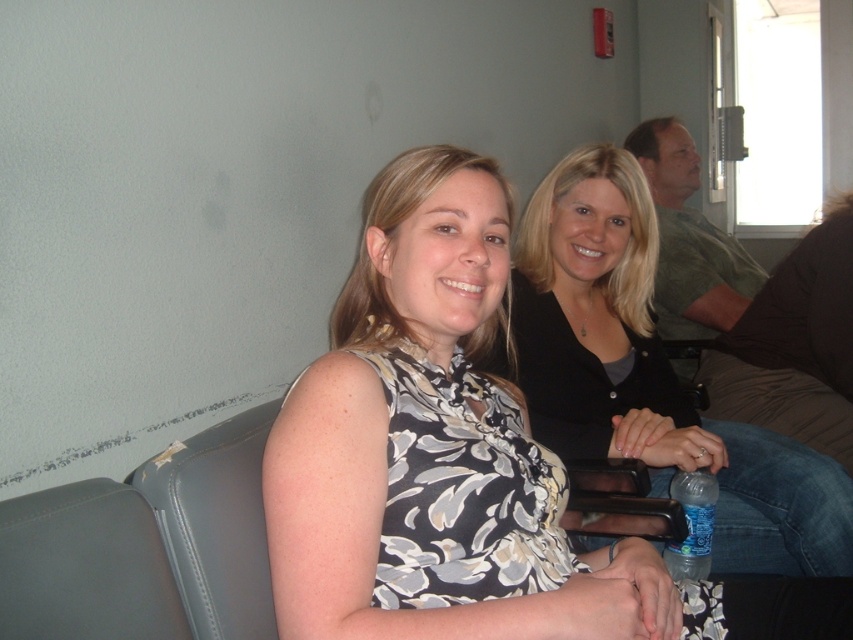
From the picture: Who is shorter, floral print blouse at center or blue plastic bottle at lower right?

blue plastic bottle at lower right

How far apart are floral print blouse at center and blue plastic bottle at lower right?

floral print blouse at center and blue plastic bottle at lower right are 23.69 inches apart from each other.

Does point (407, 396) come farther from viewer compared to point (682, 493)?

No, it is in front of (682, 493).

Locate an element on the screen. floral print blouse at center is located at coordinates (450, 456).

Does floral print blouse at center come behind gray leather chair at lower left?

Yes, it is behind gray leather chair at lower left.

Identify the location of floral print blouse at center. (450, 456).

Is point (21, 497) less distant than point (689, 518)?

Yes.

This screenshot has height=640, width=853. Identify the location of gray leather chair at lower left. (85, 566).

Where is `gray leather chair at lower left`? The width and height of the screenshot is (853, 640). gray leather chair at lower left is located at coordinates (85, 566).